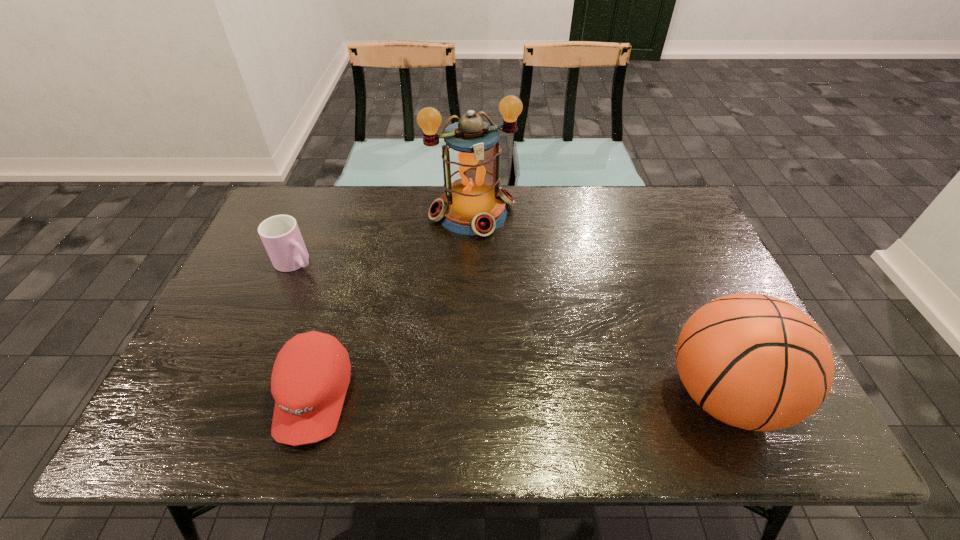
Identify the location of blank region between the basketball and the third object from right to left. This screenshot has height=540, width=960. pyautogui.click(x=518, y=395).

At what (x,y) coordinates should I click in order to perform the action: click on empty location between the third object from right to left and the basketball. Please return your answer as a coordinate pair (x, y). Looking at the image, I should click on (518, 395).

Identify the location of free space between the cup and the farthest object. This screenshot has height=540, width=960. (384, 238).

Where is `free space between the lantern and the cup`? The width and height of the screenshot is (960, 540). free space between the lantern and the cup is located at coordinates (384, 238).

Find the location of a particular element. The height and width of the screenshot is (540, 960). vacant area between the cap and the rightmost object is located at coordinates (518, 395).

Choose which object is the second nearest neighbor to the rightmost object. Please provide its 2D coordinates. Your answer should be formatted as a tuple, i.e. [(x, y)], where the tuple contains the x and y coordinates of a point satisfying the conditions above.

[(311, 374)]

Identify which object is the nearest to the cap. Please provide its 2D coordinates. Your answer should be formatted as a tuple, i.e. [(x, y)], where the tuple contains the x and y coordinates of a point satisfying the conditions above.

[(280, 234)]